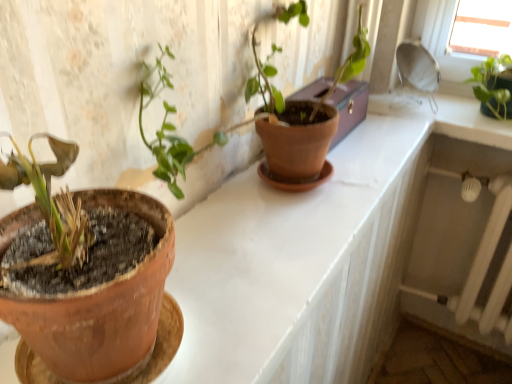
Locate an element on the screen. The image size is (512, 384). free space above matte terracotta pot at center (from a real-world perspective) is located at coordinates (292, 221).